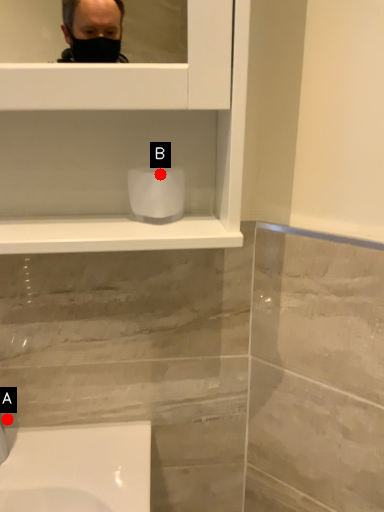
Question: Two points are circled on the image, labeled by A and B beside each circle. Which point appears farthest from the camera in this image?

Choices:
 (A) A is further
 (B) B is further

Answer: (A)